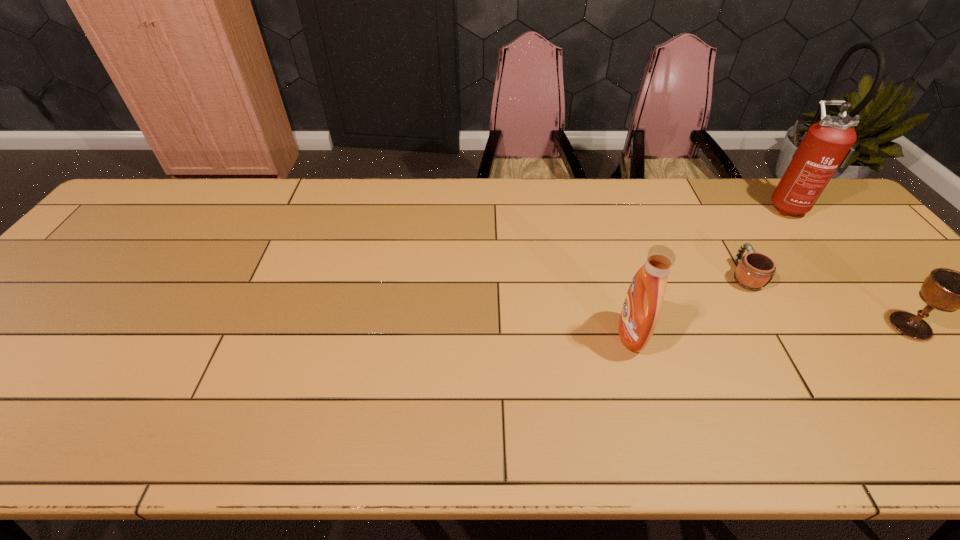
Identify the location of free space that satisfies the following two spatial constraints: 1. at the nozzle of the fire extinguisher; 2. on the right side of the chalice. This screenshot has width=960, height=540. pyautogui.click(x=882, y=326).

Image resolution: width=960 pixels, height=540 pixels. In order to click on vacant area in the image that satisfies the following two spatial constraints: 1. at the nozzle of the fire extinguisher; 2. on the left side of the chalice in this screenshot , I will do `click(882, 326)`.